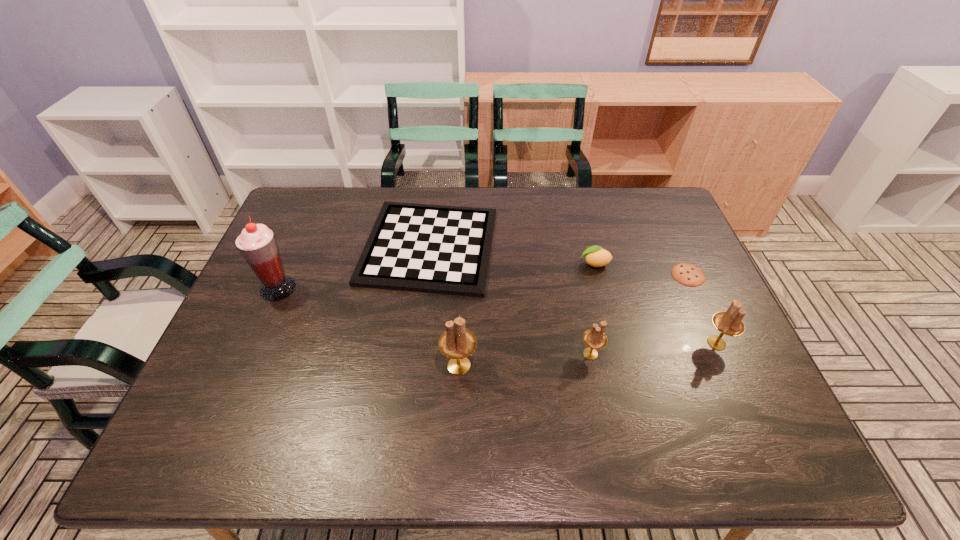
Identify the location of unoccupied area between the cookie and the second candle holder from right to left. This screenshot has width=960, height=540. (639, 314).

Image resolution: width=960 pixels, height=540 pixels. In order to click on vacant area between the third shortest object and the second shortest object in this screenshot , I will do `click(512, 255)`.

Locate an element on the screen. free space between the leftmost candle holder and the smoothie is located at coordinates (369, 327).

Identify the location of unoccupied area between the lemon and the cookie. The width and height of the screenshot is (960, 540). (641, 269).

I want to click on vacant region between the leftmost candle holder and the second shortest object, so click(444, 306).

The image size is (960, 540). Find the location of `vacant area that lies between the second tallest candle holder and the checkerboard`. vacant area that lies between the second tallest candle holder and the checkerboard is located at coordinates (573, 294).

Locate which object ranks sixth in proximity to the leftmost candle holder. Please provide its 2D coordinates. Your answer should be formatted as a tuple, i.e. [(x, y)], where the tuple contains the x and y coordinates of a point satisfying the conditions above.

[(687, 274)]

Identify which object is the fourth closest to the tallest candle holder. Please provide its 2D coordinates. Your answer should be formatted as a tuple, i.e. [(x, y)], where the tuple contains the x and y coordinates of a point satisfying the conditions above.

[(257, 244)]

At what (x,y) coordinates should I click in order to perform the action: click on candle holder identified as the closest to the leftmost candle holder. Please return your answer as a coordinate pair (x, y). Looking at the image, I should click on (594, 338).

Locate which candle holder is the second closest to the third shortest object. Please provide its 2D coordinates. Your answer should be formatted as a tuple, i.e. [(x, y)], where the tuple contains the x and y coordinates of a point satisfying the conditions above.

[(730, 323)]